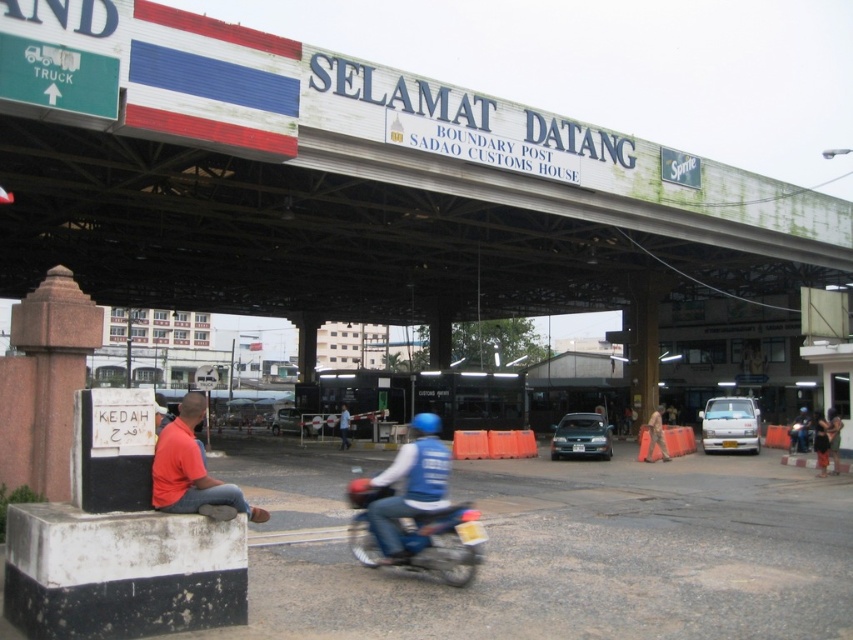
Question: Which of the following is the closest to the observer?

Choices:
 (A) (412, 524)
 (B) (824, 420)
 (C) (427, 196)
 (D) (340, 440)

Answer: (A)

Question: Does blue fabric helmet at center appear on the left side of dark blue jeans at lower right?

Choices:
 (A) no
 (B) yes

Answer: (B)

Question: From the image, what is the correct spatial relationship of metallic blue motorcycle at center in relation to orange shirt at lower left?

Choices:
 (A) above
 (B) below

Answer: (A)

Question: Is metallic blue motorcycle at center in front of orange shirt at lower left?

Choices:
 (A) yes
 (B) no

Answer: (B)

Question: Which point appears closest to the camera in this image?

Choices:
 (A) (154, 289)
 (B) (341, 410)

Answer: (B)

Question: Which object is positioned farthest from the white painted steel at upper center?

Choices:
 (A) orange shirt at lower left
 (B) dark blue jeans at lower right
 (C) metallic blue motorcycle at center

Answer: (C)